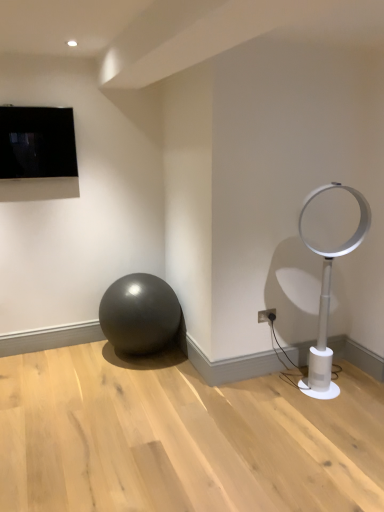
Question: Is glossy metallic ball at lower left bigger than black glossy tv at upper left?

Choices:
 (A) no
 (B) yes

Answer: (B)

Question: From a real-world perspective, is glossy metallic ball at lower left over black glossy tv at upper left?

Choices:
 (A) no
 (B) yes

Answer: (A)

Question: From a real-world perspective, does glossy metallic ball at lower left sit lower than black glossy tv at upper left?

Choices:
 (A) yes
 (B) no

Answer: (A)

Question: Does glossy metallic ball at lower left have a lesser height compared to black glossy tv at upper left?

Choices:
 (A) yes
 (B) no

Answer: (B)

Question: Is glossy metallic ball at lower left outside black glossy tv at upper left?

Choices:
 (A) no
 (B) yes

Answer: (B)

Question: From the image's perspective, is glossy metallic ball at lower left over black glossy tv at upper left?

Choices:
 (A) yes
 (B) no

Answer: (B)

Question: Does black glossy tv at upper left have a smaller size compared to white plastic electric outlet at lower right?

Choices:
 (A) yes
 (B) no

Answer: (B)

Question: Is the position of black glossy tv at upper left more distant than that of white plastic electric outlet at lower right?

Choices:
 (A) no
 (B) yes

Answer: (A)

Question: Does black glossy tv at upper left have a greater width compared to white plastic electric outlet at lower right?

Choices:
 (A) no
 (B) yes

Answer: (B)

Question: Is black glossy tv at upper left thinner than white plastic electric outlet at lower right?

Choices:
 (A) no
 (B) yes

Answer: (A)

Question: Is white plastic electric outlet at lower right located within black glossy tv at upper left?

Choices:
 (A) no
 (B) yes

Answer: (A)

Question: Is black glossy tv at upper left at the right side of white plastic electric outlet at lower right?

Choices:
 (A) no
 (B) yes

Answer: (A)

Question: Is white plastic electric outlet at lower right positioned far away from black glossy tv at upper left?

Choices:
 (A) no
 (B) yes

Answer: (B)